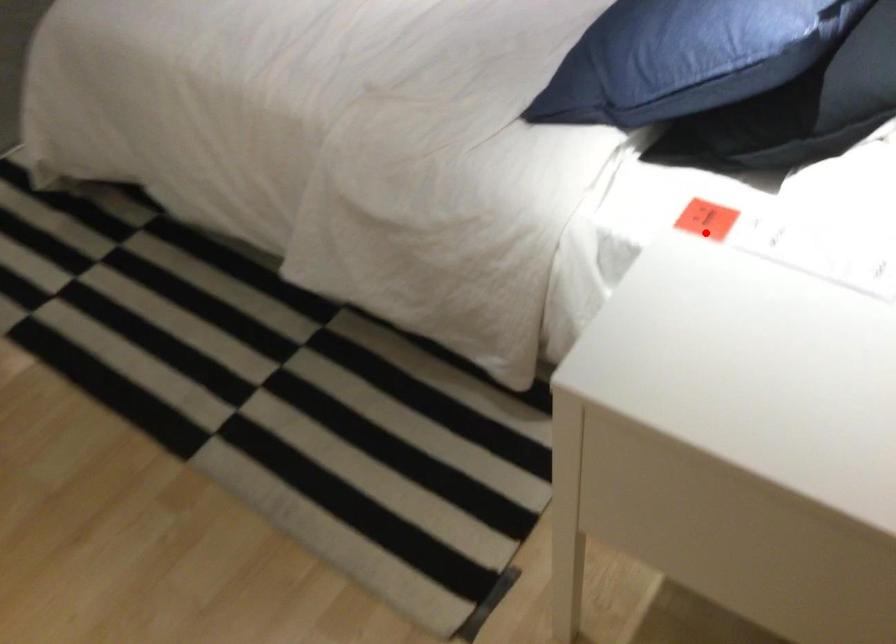
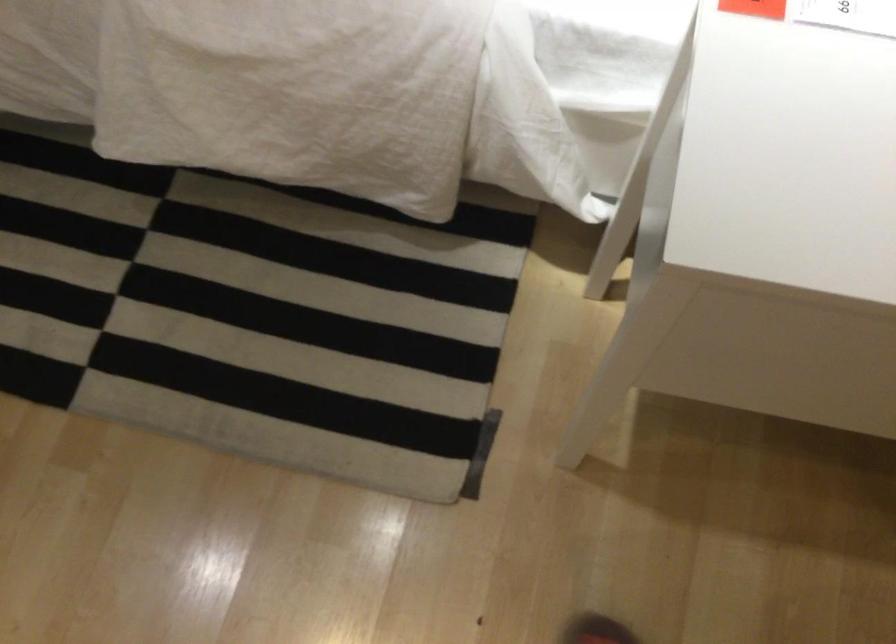
In the second image, find the point that corresponds to the highlighted location in the first image.

(754, 8)